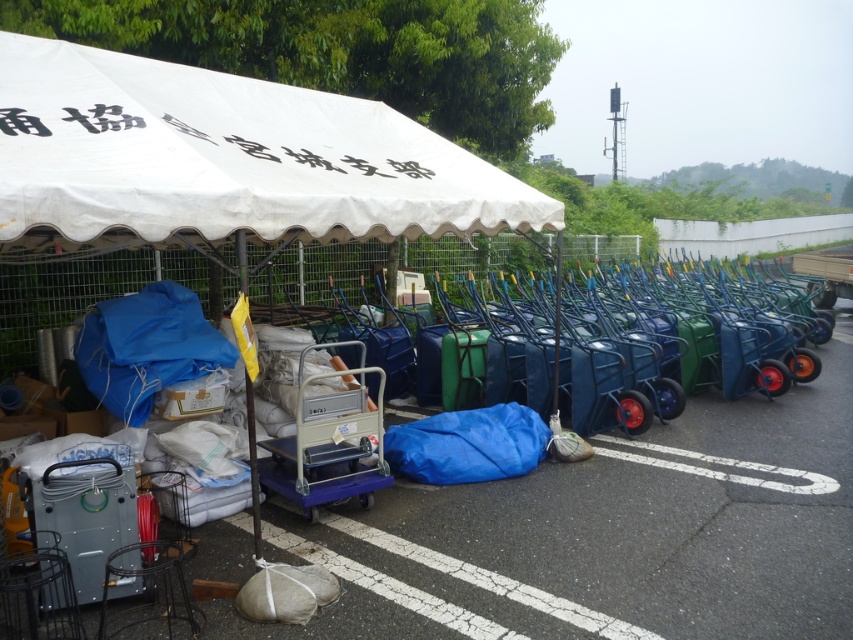
Is white fabric canopy at upper left further to the viewer compared to metallic blue cart at center?

That is False.

Can you confirm if white fabric canopy at upper left is positioned to the left of metallic blue cart at center?

Yes, white fabric canopy at upper left is to the left of metallic blue cart at center.

Between point (35, 205) and point (296, 480), which one is positioned in front?

Point (35, 205) is in front.

Identify the location of white fabric canopy at upper left. This screenshot has height=640, width=853. (224, 157).